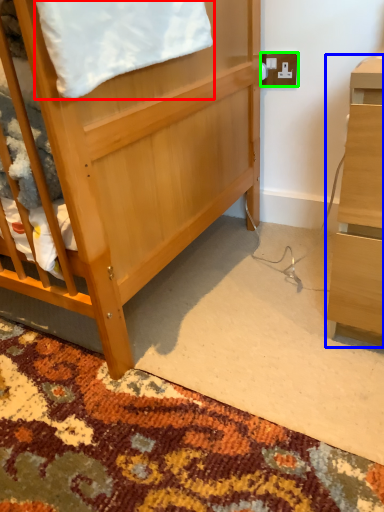
Question: Considering the real-world distances, which object is closest to blanket (highlighted by a red box)? desk (highlighted by a blue box) or electric outlet (highlighted by a green box).

Choices:
 (A) desk
 (B) electric outlet

Answer: (A)